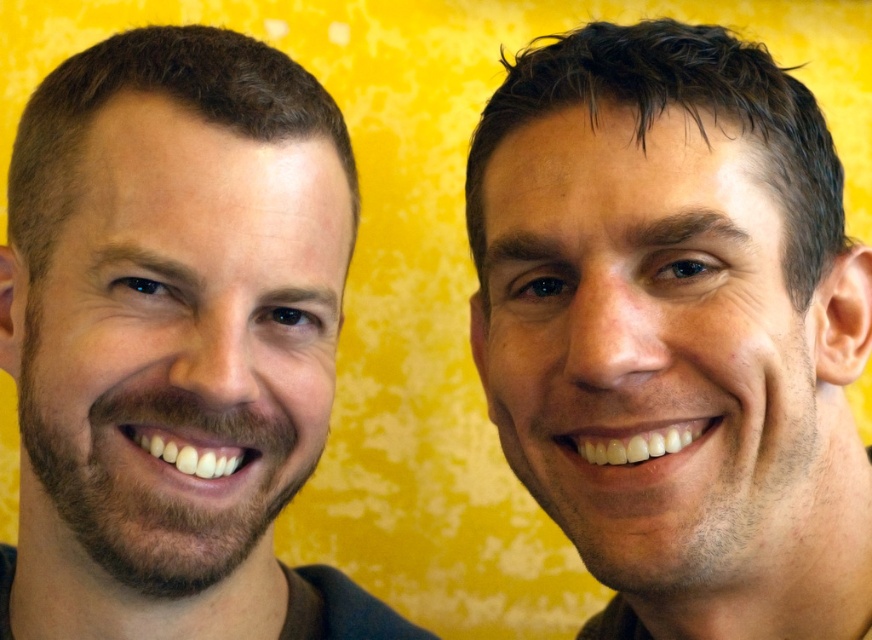
Based on the scene description, can you determine which object has a wider width between the smooth skin face at center and the brown hair at left?

The brown hair at left has a greater width than the smooth skin face at center according to the description.

You are a photographer trying to capture a portrait of the two people in the image. You need to ensure that the smooth skin face at center and the brown hair at left are both clearly visible in the frame. Based on their positions, which one should you focus on first to ensure proper focus?

The smooth skin face at center is below the brown hair at left, so you should focus on the brown hair at left first to ensure both are in focus.

You are a photographer adjusting the camera settings to ensure both the smooth skin face at center and the brown hair at left are in focus. Which object should you focus on first to ensure proper depth of field?

The smooth skin face at center should be focused on first because it has a greater height compared to the brown hair at left, ensuring it remains sharp in the photo.